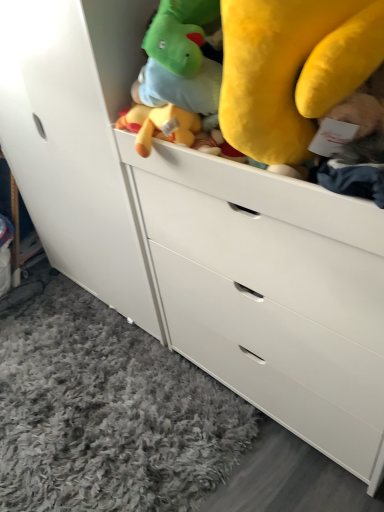
Find the location of a particular element. vacant area situated below gray shag rug at lower left (from a real-world perspective) is located at coordinates (89, 434).